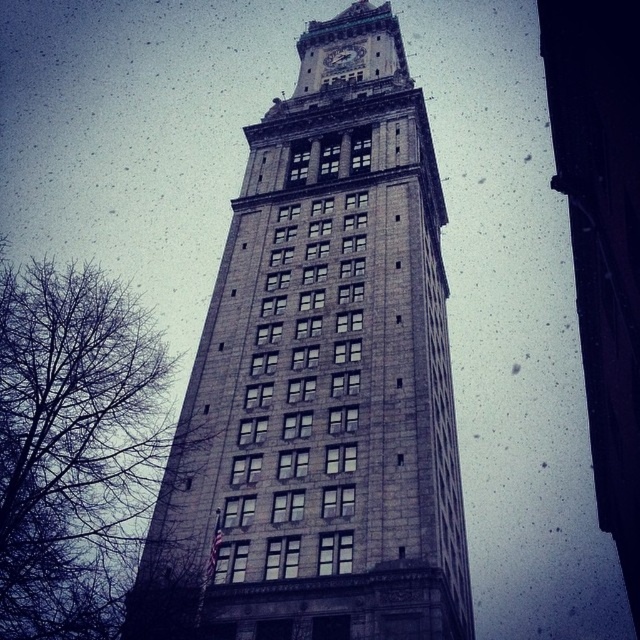
Does gray stone clock tower at center have a greater height compared to white marble clock at upper center?

Yes, gray stone clock tower at center is taller than white marble clock at upper center.

Does gray stone clock tower at center appear on the left side of white marble clock at upper center?

Indeed, gray stone clock tower at center is positioned on the left side of white marble clock at upper center.

At what (x,y) coordinates should I click in order to perform the action: click on gray stone clock tower at center. Please return your answer as a coordinate pair (x, y). Looking at the image, I should click on point(321,381).